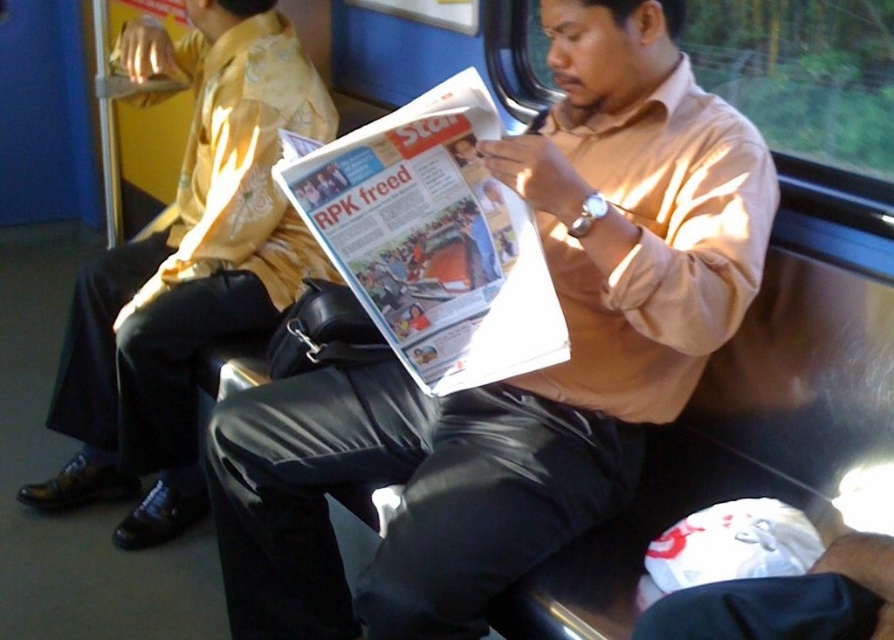
Question: Can you confirm if matte brown shirt at center is positioned above matte black pants at lower left?

Choices:
 (A) no
 (B) yes

Answer: (A)

Question: Does matte black pants at lower left have a lesser width compared to white glossy newspaper at center?

Choices:
 (A) no
 (B) yes

Answer: (A)

Question: Which object appears farthest from the camera in this image?

Choices:
 (A) white glossy newspaper at center
 (B) matte brown shirt at center

Answer: (A)

Question: Which of the following is the closest to the observer?

Choices:
 (A) white glossy newspaper at center
 (B) matte black pants at lower left

Answer: (A)

Question: Based on their relative distances, which object is nearer to the white glossy newspaper at center?

Choices:
 (A) matte brown shirt at center
 (B) matte black pants at lower left

Answer: (A)

Question: Can you confirm if matte brown shirt at center is positioned below matte black pants at lower left?

Choices:
 (A) yes
 (B) no

Answer: (A)